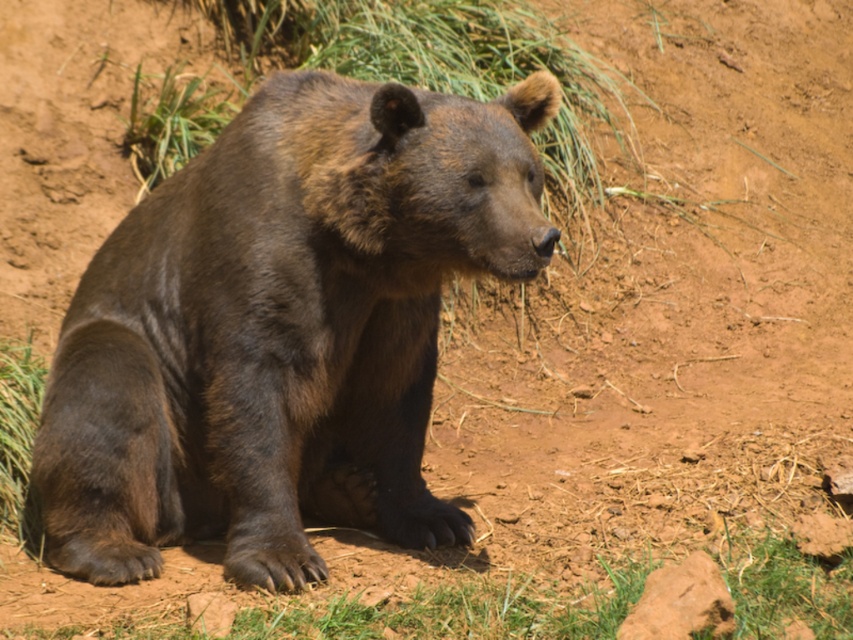
You are a wildlife photographer aiming to capture the brown furry bear at center. You need to position your camera exactly at the point with coordinates point (282, 328). Can you confirm if this point is located on the bear?

Yes, the point (282, 328) corresponds to the brown furry bear at center, so it is located on the bear.

You are a photographer trying to capture a photo of the brown furry bear at center and the green grass at upper left in the scene. Which object is taller?

The brown furry bear at center is much taller than the green grass at upper left.